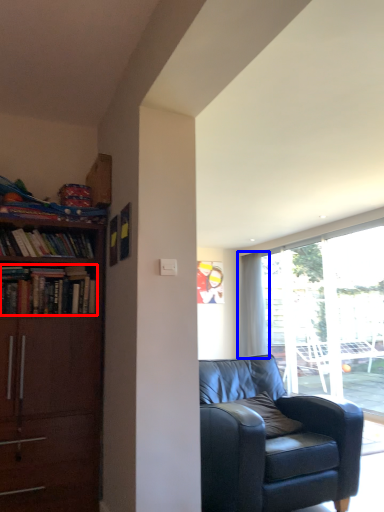
Question: Which point is closer to the camera, book (highlighted by a red box) or curtain (highlighted by a blue box)?

Choices:
 (A) book
 (B) curtain

Answer: (A)